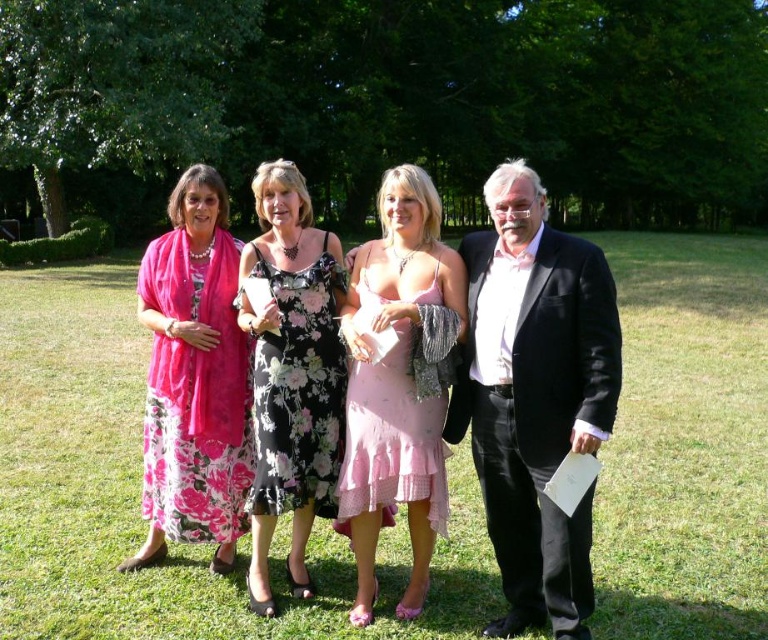
You are a photographer at the event and need to adjust the camera focus. Which person should you focus on first if you want to capture both the pink floral dress at center and the black satin suit at right in the same frame? Explain your reasoning based on their positions and heights.

You should focus on the black satin suit at right first because it is taller than the pink floral dress at center, ensuring it is in focus while the shorter dress will still be within the depth of field.

You are planning to sit between the pink floral dress at left and the pink chiffon dress at center. Which dress should you sit closer to if you want to maximize your personal space?

You should sit closer to the pink chiffon dress at center because the pink floral dress at left might be wider, requiring more space between you and them.